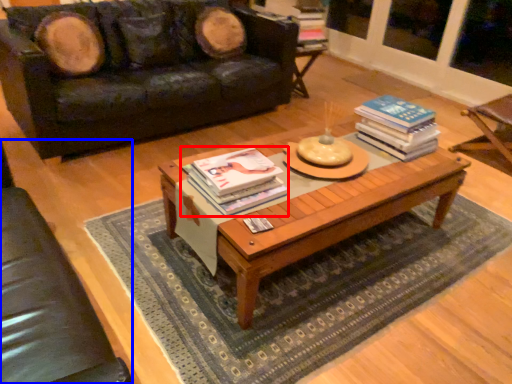
Question: Among these objects, which one is farthest to the camera, book (highlighted by a red box) or armchair (highlighted by a blue box)?

Choices:
 (A) book
 (B) armchair

Answer: (A)